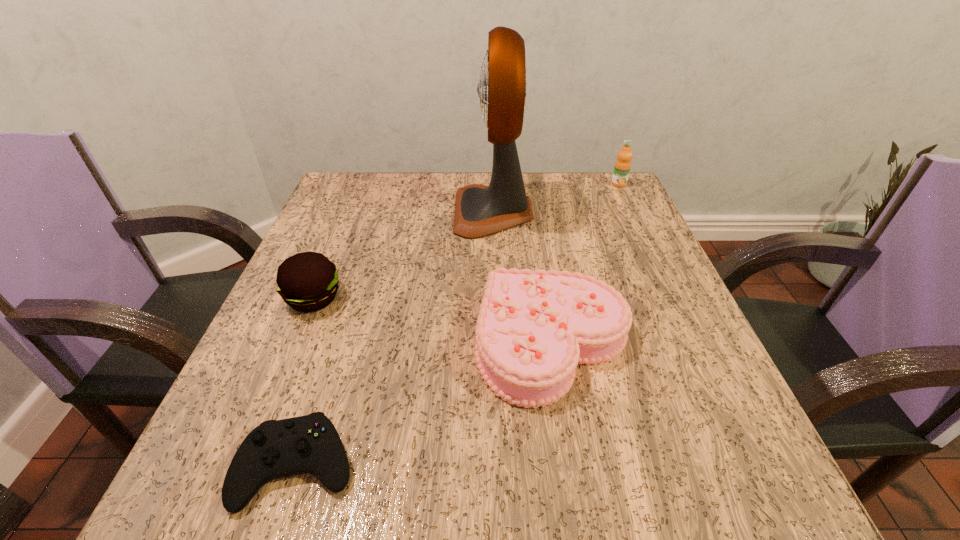
The image size is (960, 540). In order to click on vacant space at the far right corner of the desktop in this screenshot , I will do `click(593, 216)`.

In order to click on free space at the near right corner in this screenshot , I will do `click(744, 475)`.

This screenshot has width=960, height=540. What are the coordinates of `vacant area that lies between the fourth tallest object and the control` in the screenshot? It's located at (425, 404).

I want to click on unoccupied area between the cake and the shortest object, so click(425, 404).

Locate an element on the screen. The height and width of the screenshot is (540, 960). free spot between the patty and the control is located at coordinates (305, 382).

This screenshot has height=540, width=960. I want to click on vacant space in between the fan and the shortest object, so click(396, 339).

You are a GUI agent. You are given a task and a screenshot of the screen. Output one action in this format:
    pyautogui.click(x=<x>, y=<y>)
    Task: Click on the unoccupied area between the orange juice and the fourth nearest object
    
    Given the screenshot: What is the action you would take?
    pyautogui.click(x=556, y=198)

This screenshot has width=960, height=540. In order to click on free space between the control and the rightmost object in this screenshot , I will do `click(458, 325)`.

Image resolution: width=960 pixels, height=540 pixels. Identify the location of unoccupied area between the farthest object and the control. (458, 325).

Locate an element on the screen. empty space between the second farthest object and the rightmost object is located at coordinates (556, 198).